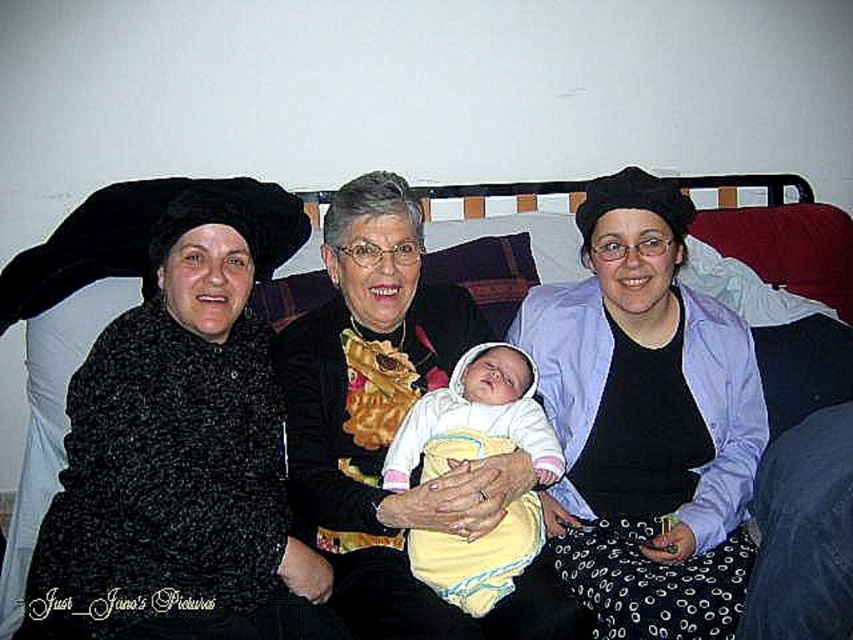
Does matte black coat at left appear under yellow fleece baby at center?

Actually, matte black coat at left is above yellow fleece baby at center.

This screenshot has width=853, height=640. In order to click on matte black coat at left in this screenshot , I will do `click(67, 337)`.

Between matte black beret at center and matte black coat at left, which one appears on the right side from the viewer's perspective?

matte black beret at center is more to the right.

The image size is (853, 640). In order to click on matte black beret at center in this screenshot , I will do `click(646, 420)`.

Describe the element at coordinates (646, 420) in the screenshot. The width and height of the screenshot is (853, 640). I see `matte black beret at center` at that location.

In order to click on matte black beret at center in this screenshot , I will do `click(646, 420)`.

Based on the photo, can you confirm if matte black beret at center is smaller than yellow fleece baby at center?

No, matte black beret at center is not smaller than yellow fleece baby at center.

Measure the distance between matte black beret at center and camera.

A distance of 1.40 meters exists between matte black beret at center and camera.

What do you see at coordinates (646, 420) in the screenshot? The width and height of the screenshot is (853, 640). I see `matte black beret at center` at bounding box center [646, 420].

Identify the location of matte black beret at center. (646, 420).